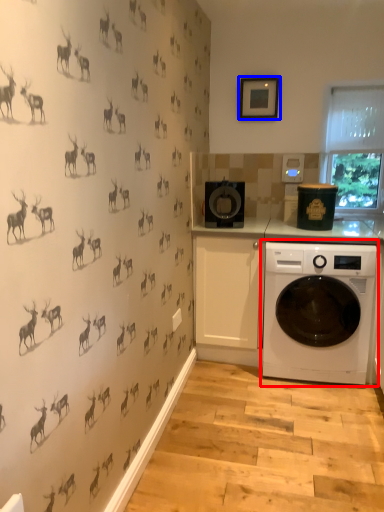
Question: Among these objects, which one is farthest to the camera, washing machine (highlighted by a red box) or picture frame (highlighted by a blue box)?

Choices:
 (A) washing machine
 (B) picture frame

Answer: (B)